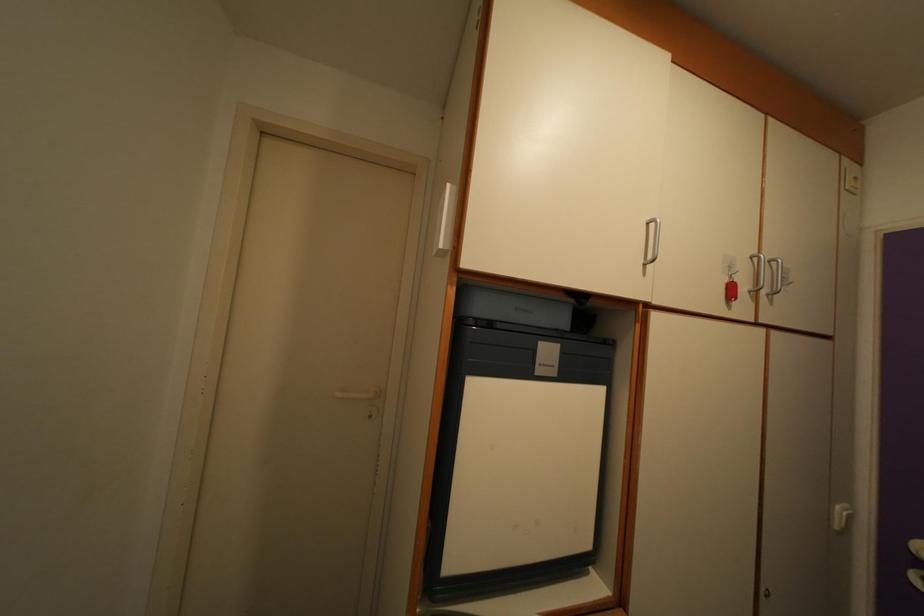
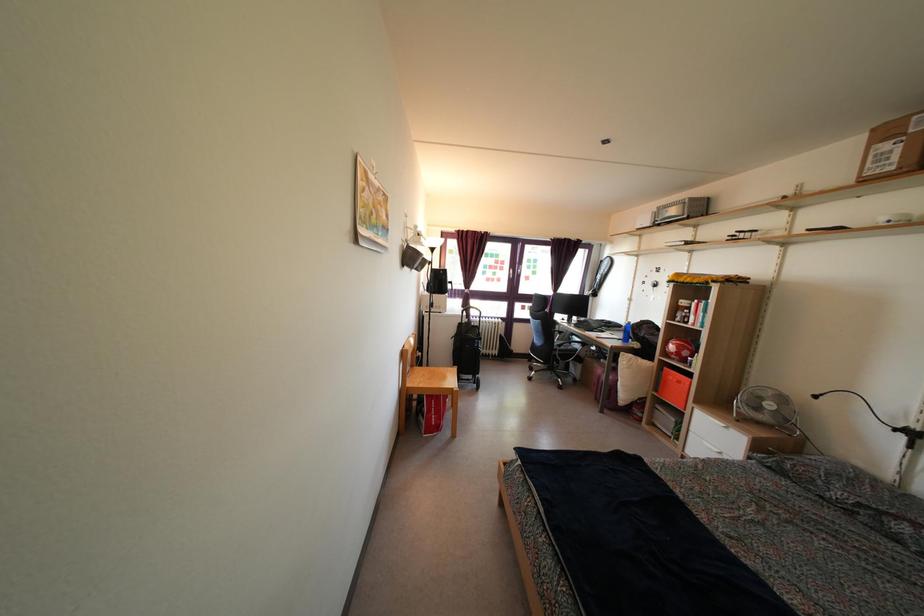
Question: The images are taken continuously from a first-person perspective. In which direction is your viewpoint rotating?

Choices:
 (A) Left
 (B) Right
 (C) Up
 (D) Down

Answer: (A)